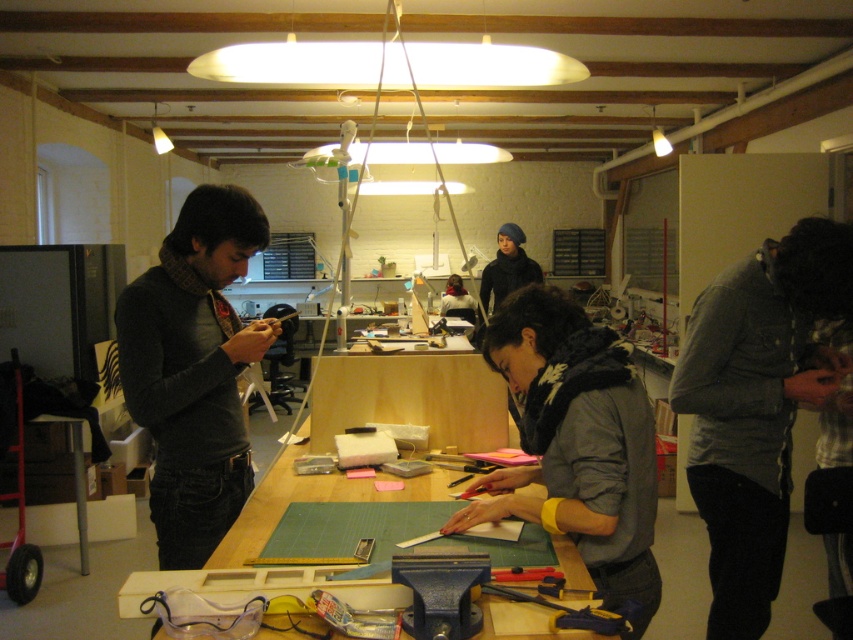
You are organizing a workshop and need to ensure that the gray fabric scarf at center is visible to all participants. Since the green matte table at center is in the way, where should you position the scarf relative to the table?

The gray fabric scarf at center is already positioned in front of the green matte table at center, so it is already visible. To keep it visible, ensure it remains in front of the table.

You are organizing a workshop cleanup. You need to retrieve the gray fabric scarf at center from under the gray textured jacket at lower right. Is the scarf accessible without moving the jacket?

The gray fabric scarf at center is behind the gray textured jacket at lower right, so you cannot access it without moving the jacket.